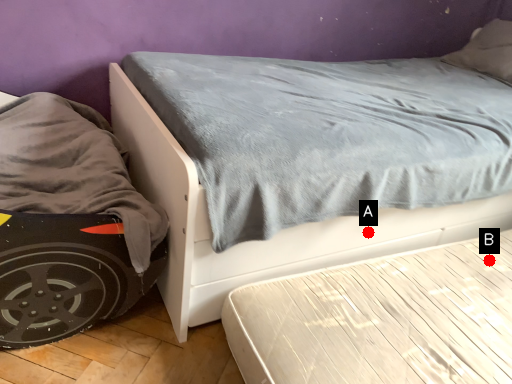
Question: Two points are circled on the image, labeled by A and B beside each circle. Which point is closer to the camera taking this photo?

Choices:
 (A) A is closer
 (B) B is closer

Answer: (A)